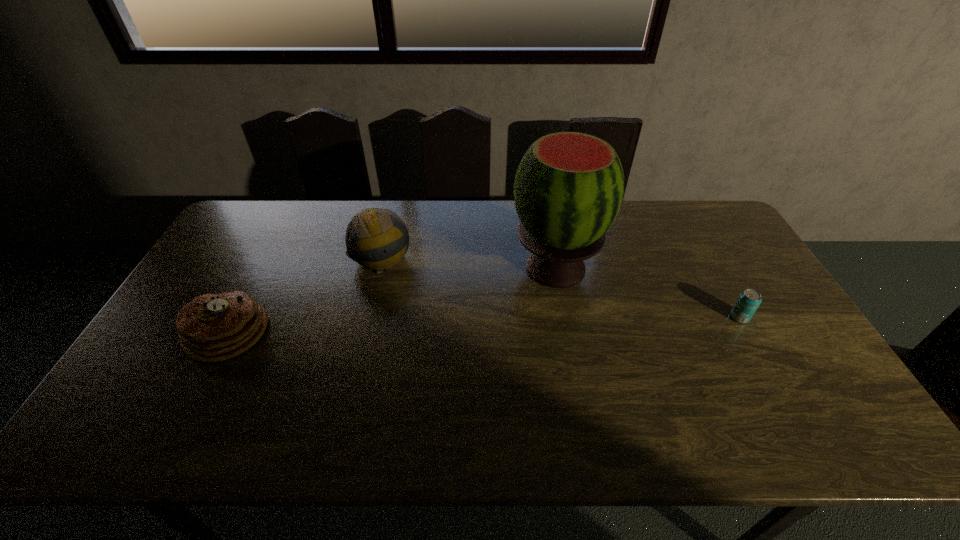
At what (x,y) coordinates should I click in order to perform the action: click on empty space that is in between the second tallest object and the shortest object. Please return your answer as a coordinate pair (x, y). The height and width of the screenshot is (540, 960). Looking at the image, I should click on (561, 288).

The image size is (960, 540). I want to click on empty location between the rightmost object and the third tallest object, so click(483, 325).

Identify the location of empty space between the shortest object and the pancake. Image resolution: width=960 pixels, height=540 pixels. pyautogui.click(x=483, y=325).

Locate an element on the screen. The width and height of the screenshot is (960, 540). vacant space in between the tallest object and the leftmost object is located at coordinates (392, 300).

Find the location of a particular element. empty space that is in between the tallest object and the rightmost object is located at coordinates (647, 293).

At what (x,y) coordinates should I click in order to perform the action: click on vacant region between the third shortest object and the beer can. Please return your answer as a coordinate pair (x, y). The width and height of the screenshot is (960, 540). Looking at the image, I should click on [x=561, y=288].

Where is `free space between the watermelon and the leftmost object`? free space between the watermelon and the leftmost object is located at coordinates (392, 300).

Find the location of `vacant point located between the leftmost object and the second object from right to left`. vacant point located between the leftmost object and the second object from right to left is located at coordinates (392, 300).

At what (x,y) coordinates should I click in order to perform the action: click on vacant space in between the leftmost object and the watermelon. Please return your answer as a coordinate pair (x, y). Looking at the image, I should click on (392, 300).

Image resolution: width=960 pixels, height=540 pixels. I want to click on free space between the pancake and the tallest object, so click(x=392, y=300).